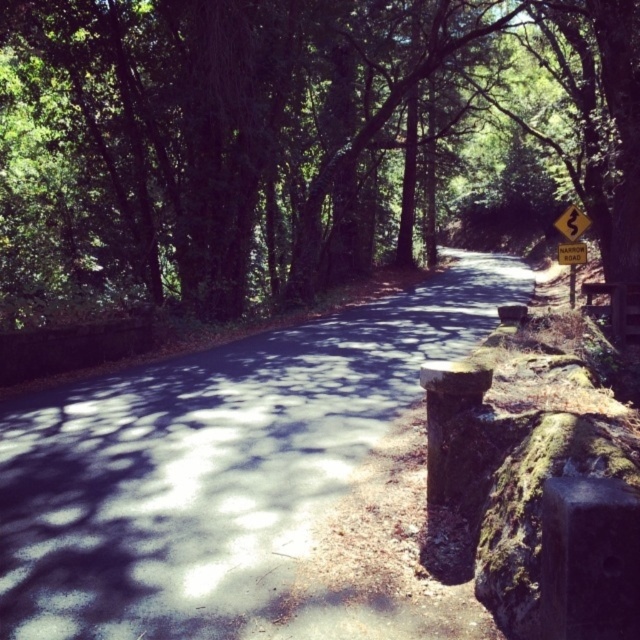
You are a hiker on the road and want to read the yellow paper sign at upper right and the yellow reflective plastic road sign at upper right. Which one is shorter?

The yellow paper sign at upper right is shorter than the yellow reflective plastic road sign at upper right.